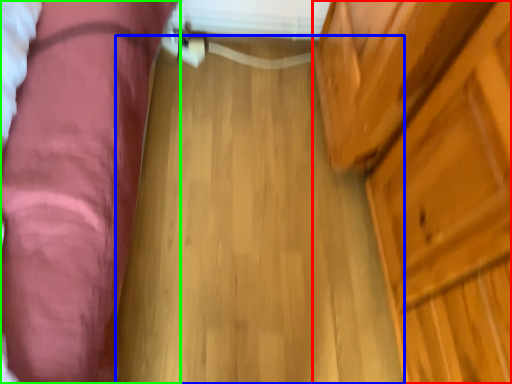
Question: Which object is positioned farthest from dresser (highlighted by a red box)? Select from plank (highlighted by a blue box) and furniture (highlighted by a green box).

Choices:
 (A) plank
 (B) furniture

Answer: (B)